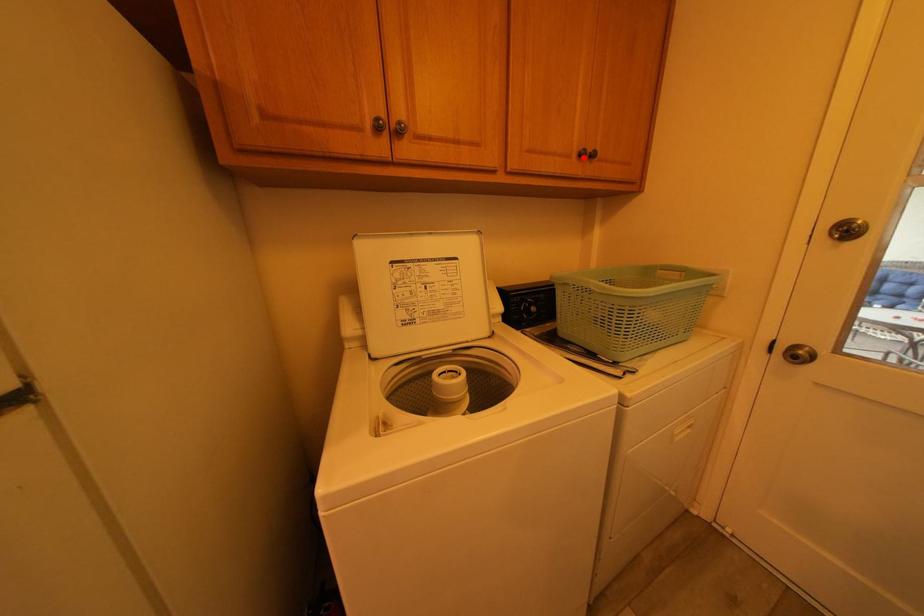
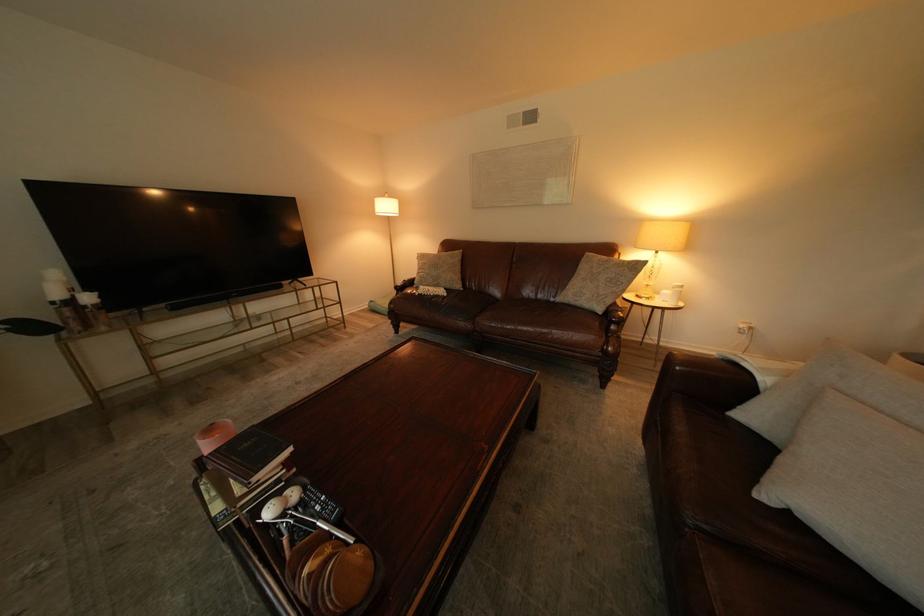
Question: I am providing you with two images of the same scene from different viewpoints. A red point is marked on the first image. Is the red point's position out of view in image 2?

Choices:
 (A) Yes
 (B) No

Answer: (A)